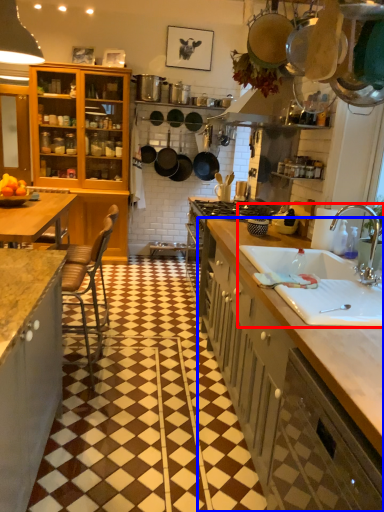
Question: Which point is further to the camera, sink (highlighted by a red box) or cabinetry (highlighted by a blue box)?

Choices:
 (A) sink
 (B) cabinetry

Answer: (B)